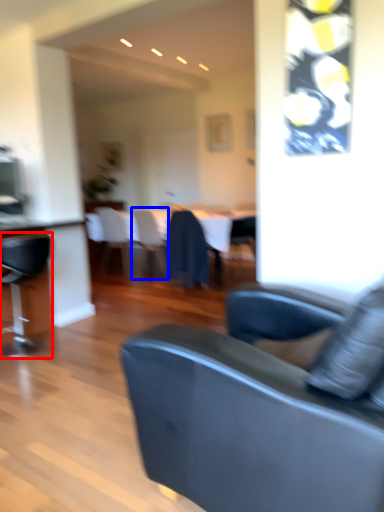
Question: Among these objects, which one is farthest to the camera, chair (highlighted by a red box) or chair (highlighted by a blue box)?

Choices:
 (A) chair
 (B) chair

Answer: (B)